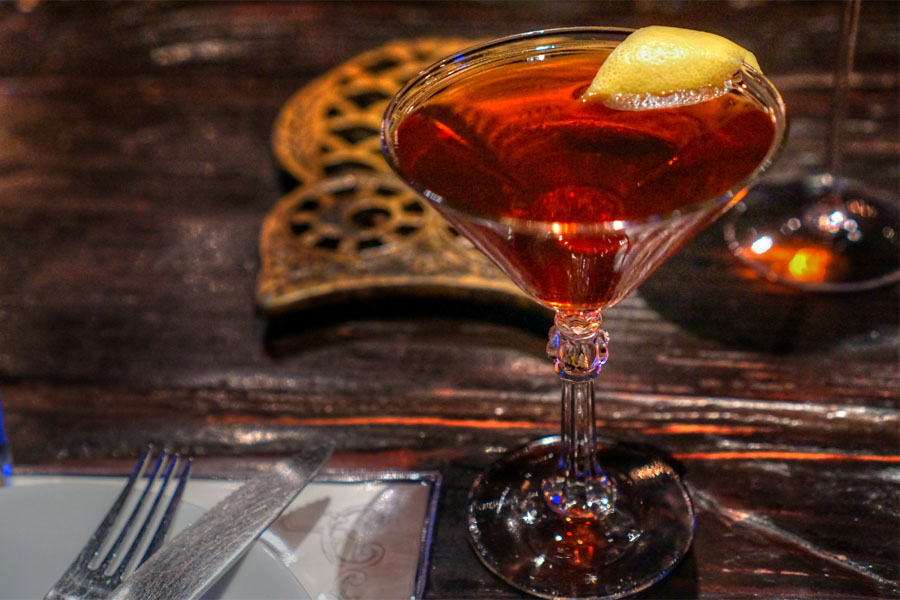
Where is `glass`? The height and width of the screenshot is (600, 900). glass is located at coordinates (547, 199).